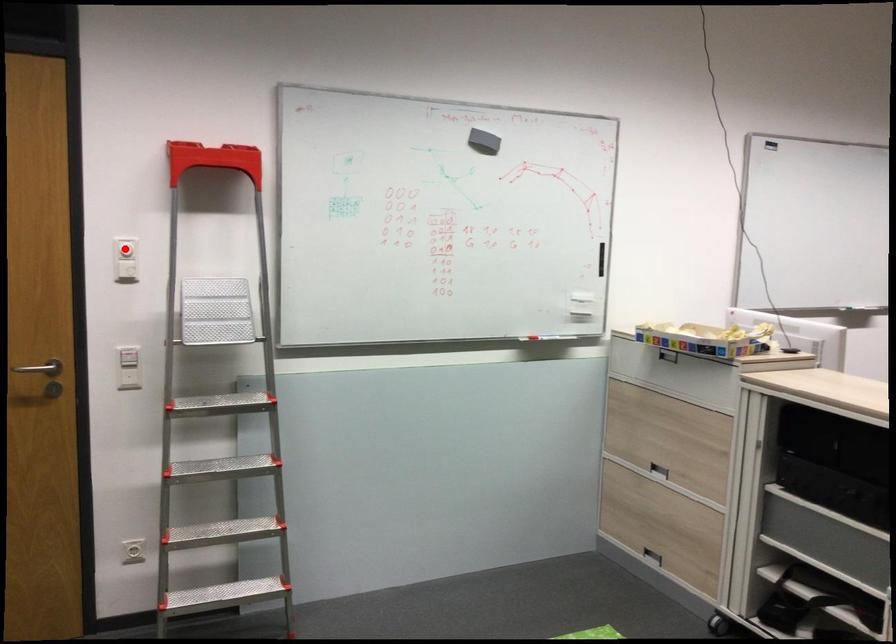
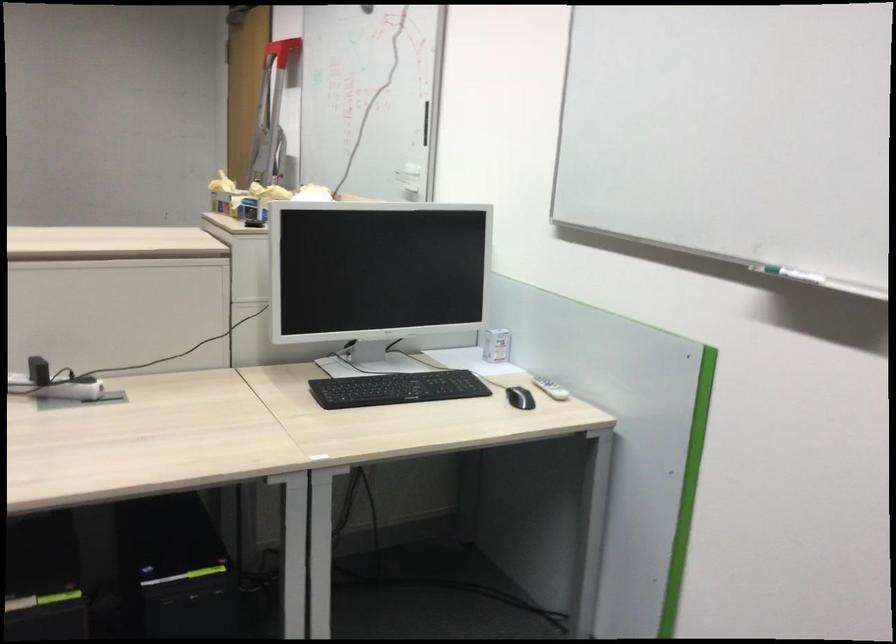
Question: I am providing you with two images of the same scene from different viewpoints. A red point is marked on the first image. Can you still see the location of the red point in image 2?

Choices:
 (A) Yes
 (B) No

Answer: (B)